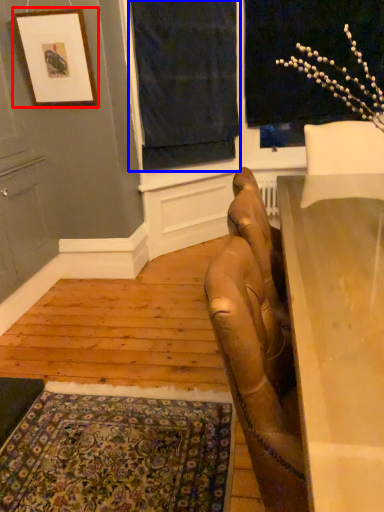
Question: Which object appears closest to the camera in this image, picture frame (highlighted by a red box) or curtain (highlighted by a blue box)?

Choices:
 (A) picture frame
 (B) curtain

Answer: (A)